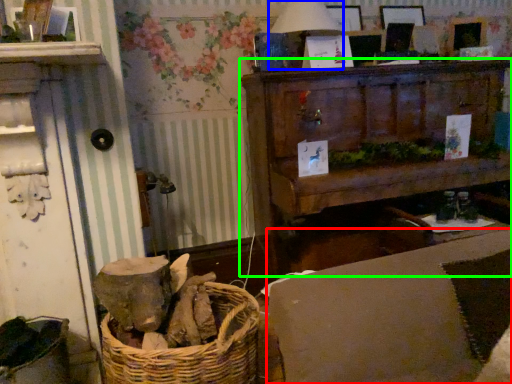
Question: Considering the real-world distances, which object is closest to couch (highlighted by a red box)? table lamp (highlighted by a blue box) or furniture (highlighted by a green box).

Choices:
 (A) table lamp
 (B) furniture

Answer: (B)